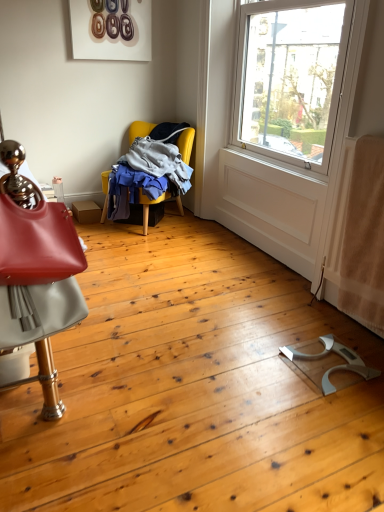
Question: Is matte red chair at left, placed as the 2th chair when sorted from top to bottom, with yellow fabric chair at upper left, positioned as the first chair in back-to-front order?

Choices:
 (A) yes
 (B) no

Answer: (B)

Question: Is matte red chair at left, positioned as the first chair in bottom-to-top order, outside yellow fabric chair at upper left, the second chair viewed from the front?

Choices:
 (A) yes
 (B) no

Answer: (A)

Question: Does matte red chair at left, placed as the 2th chair when sorted from top to bottom, have a smaller size compared to yellow fabric chair at upper left, the second chair ordered from the bottom?

Choices:
 (A) yes
 (B) no

Answer: (A)

Question: Could you tell me if matte red chair at left, which is counted as the second chair, starting from the back, is turned towards yellow fabric chair at upper left, the second chair viewed from the front?

Choices:
 (A) no
 (B) yes

Answer: (A)

Question: Is the position of matte red chair at left, which is counted as the second chair, starting from the back, more distant than that of yellow fabric chair at upper left, the second chair ordered from the bottom?

Choices:
 (A) yes
 (B) no

Answer: (B)

Question: Considering the relative sizes of matte red chair at left, positioned as the first chair in bottom-to-top order, and yellow fabric chair at upper left, positioned as the first chair in back-to-front order, in the image provided, is matte red chair at left, positioned as the first chair in bottom-to-top order, wider than yellow fabric chair at upper left, positioned as the first chair in back-to-front order,?

Choices:
 (A) no
 (B) yes

Answer: (A)

Question: Is yellow fabric chair at upper left, the second chair ordered from the bottom, to the left of matte red chair at left, positioned as the first chair in bottom-to-top order, from the viewer's perspective?

Choices:
 (A) yes
 (B) no

Answer: (B)

Question: From a real-world perspective, is yellow fabric chair at upper left, marked as the first chair in a top-to-bottom arrangement, below matte red chair at left, positioned as the first chair in bottom-to-top order?

Choices:
 (A) yes
 (B) no

Answer: (A)

Question: From the image's perspective, does yellow fabric chair at upper left, the second chair ordered from the bottom, appear higher than matte red chair at left, which is the first chair in front-to-back order?

Choices:
 (A) yes
 (B) no

Answer: (A)

Question: Is yellow fabric chair at upper left, positioned as the first chair in back-to-front order, wider than matte red chair at left, which is counted as the second chair, starting from the back?

Choices:
 (A) no
 (B) yes

Answer: (B)

Question: Is yellow fabric chair at upper left, the second chair ordered from the bottom, outside of matte red chair at left, which is the first chair in front-to-back order?

Choices:
 (A) no
 (B) yes

Answer: (B)

Question: Is yellow fabric chair at upper left, the second chair viewed from the front, bigger than matte red chair at left, placed as the 2th chair when sorted from top to bottom?

Choices:
 (A) no
 (B) yes

Answer: (B)

Question: From a real-world perspective, is matte red chair at left, placed as the 2th chair when sorted from top to bottom, positioned above or below yellow fabric chair at upper left, the second chair ordered from the bottom?

Choices:
 (A) above
 (B) below

Answer: (A)